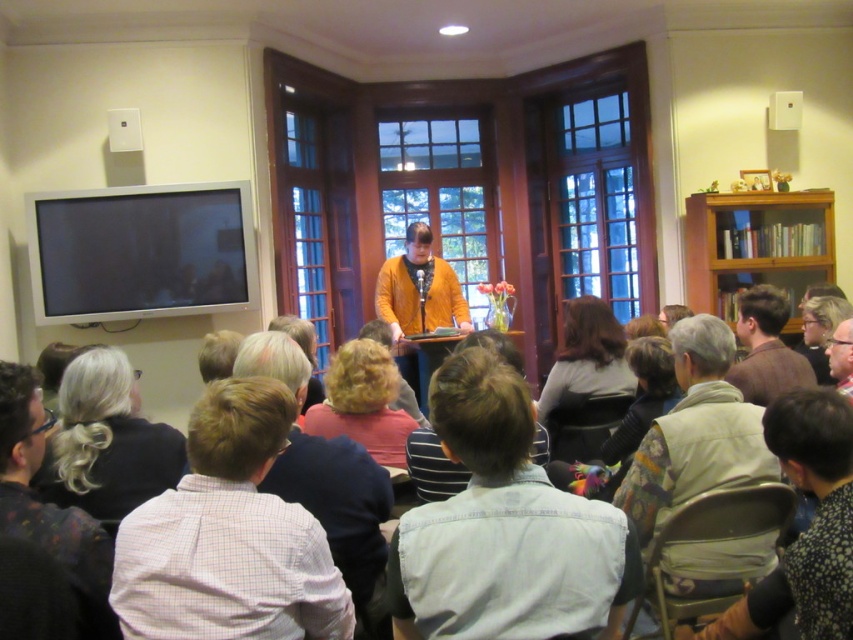
You are standing at the front of the room where the presentation is happening. You notice two points marked in the scene. Which point is closer to you, point (401, 593) or point (833, 316)?

Point (401, 593) is closer to the viewer than point (833, 316).

You are sitting in the front row of the presentation and notice two people in the audience. One is wearing a denim shirt at lower center and the other has light brown hair at lower right. From your perspective, which person is positioned more to the left?

The denim shirt at lower center is positioned to the left of light brown hair at lower right, so the denim shirt at lower center is more to the left.